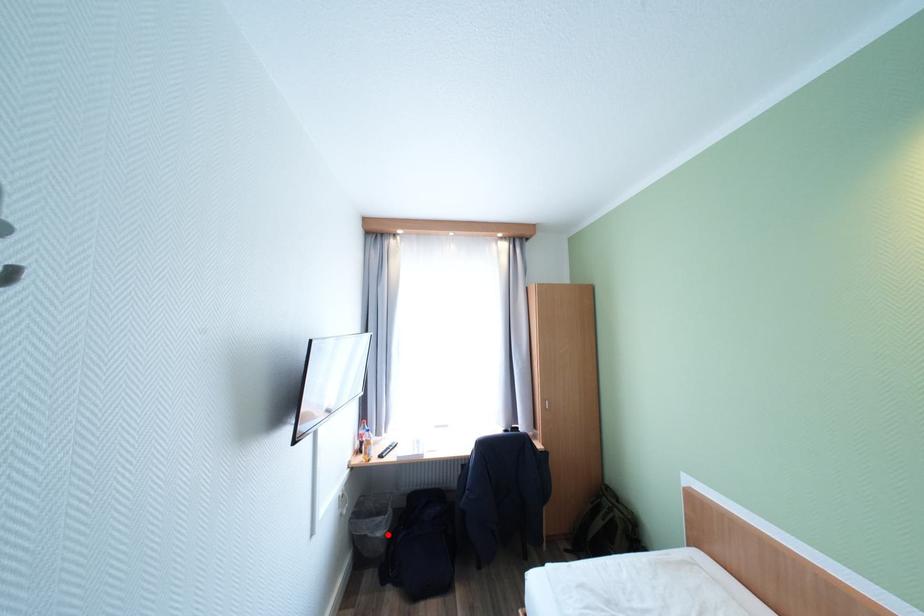
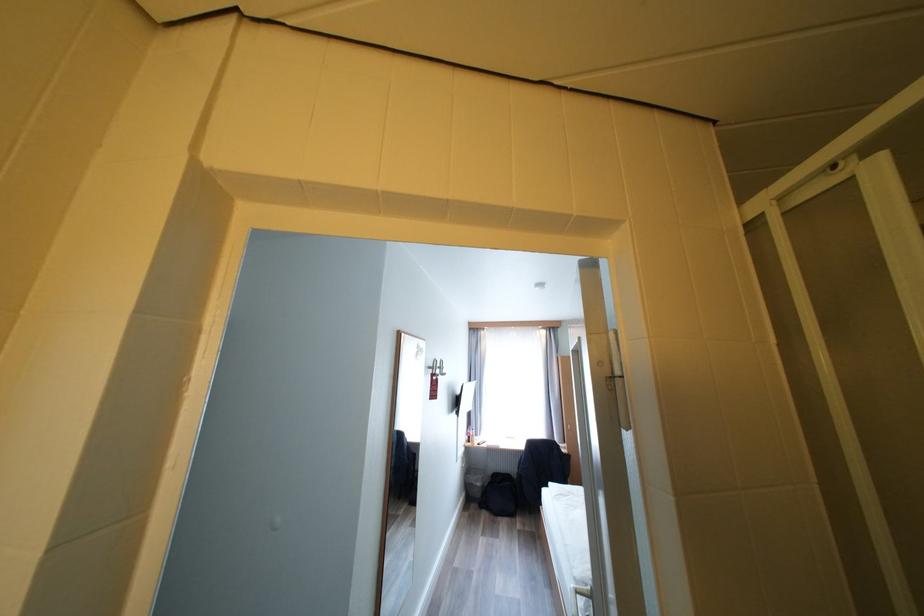
Question: A red point is marked in image1. In image2, is the corresponding 3D point closer to the camera or farther? Reply with the corresponding letter.

Choices:
 (A) The corresponding 3D point is closer.
 (B) The corresponding 3D point is farther.

Answer: (B)